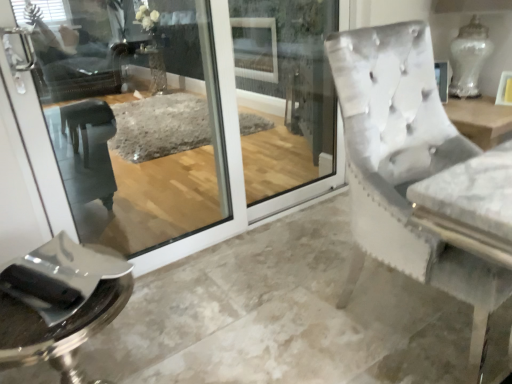
I want to click on clear glass screen door at center, so click(x=240, y=167).

What is the approximate width of clear glass screen door at center?

It is 2.42 inches.

The image size is (512, 384). Describe the element at coordinates (240, 167) in the screenshot. I see `clear glass screen door at center` at that location.

The width and height of the screenshot is (512, 384). I want to click on polished chrome tray at lower left, so click(58, 303).

The width and height of the screenshot is (512, 384). What do you see at coordinates (58, 303) in the screenshot? I see `polished chrome tray at lower left` at bounding box center [58, 303].

What is the approximate height of polished chrome tray at lower left?

polished chrome tray at lower left is 22.85 inches in height.

The width and height of the screenshot is (512, 384). I want to click on clear glass screen door at center, so click(x=240, y=167).

Which is more to the right, polished chrome tray at lower left or clear glass screen door at center?

Positioned to the right is clear glass screen door at center.

Relative to clear glass screen door at center, is polished chrome tray at lower left in front or behind?

In the image, polished chrome tray at lower left appears in front of clear glass screen door at center.

Considering the points (42, 357) and (242, 193), which point is behind, point (42, 357) or point (242, 193)?

The point (242, 193) is behind.

From the image's perspective, is polished chrome tray at lower left on clear glass screen door at center?

No.

From a real-world perspective, which is physically below, polished chrome tray at lower left or clear glass screen door at center?

polished chrome tray at lower left is physically lower.

Considering the relative sizes of polished chrome tray at lower left and clear glass screen door at center in the image provided, is polished chrome tray at lower left thinner than clear glass screen door at center?

No, polished chrome tray at lower left is not thinner than clear glass screen door at center.

Considering the relative sizes of polished chrome tray at lower left and clear glass screen door at center in the image provided, is polished chrome tray at lower left shorter than clear glass screen door at center?

Correct, polished chrome tray at lower left is not as tall as clear glass screen door at center.

From the picture: Who is smaller, polished chrome tray at lower left or clear glass screen door at center?

With smaller size is polished chrome tray at lower left.

Is clear glass screen door at center surrounded by polished chrome tray at lower left?

No, clear glass screen door at center is not a part of polished chrome tray at lower left.

Is polished chrome tray at lower left not close to clear glass screen door at center?

polished chrome tray at lower left is far away from clear glass screen door at center.

Is polished chrome tray at lower left looking in the opposite direction of clear glass screen door at center?

polished chrome tray at lower left does not have its back to clear glass screen door at center.

Can you tell me how much polished chrome tray at lower left and clear glass screen door at center differ in facing direction?

0.143 degrees separate the facing orientations of polished chrome tray at lower left and clear glass screen door at center.

This screenshot has height=384, width=512. In order to click on furniture beneath the clear glass screen door at center (from a real-world perspective) in this screenshot , I will do `click(58, 303)`.

Which is more to the right, clear glass screen door at center or polished chrome tray at lower left?

clear glass screen door at center is more to the right.

In the image, is clear glass screen door at center positioned in front of or behind polished chrome tray at lower left?

clear glass screen door at center is positioned farther from the viewer than polished chrome tray at lower left.

Which point is more distant from viewer, (223, 91) or (62, 283)?

The point (223, 91) is behind.

In the scene shown: From the image's perspective, relative to polished chrome tray at lower left, is clear glass screen door at center above or below?

From the image's perspective, clear glass screen door at center appears above polished chrome tray at lower left.

From a real-world perspective, which is physically above, clear glass screen door at center or polished chrome tray at lower left?

clear glass screen door at center, from a real-world perspective.

Is clear glass screen door at center wider than polished chrome tray at lower left?

In fact, clear glass screen door at center might be narrower than polished chrome tray at lower left.

Between clear glass screen door at center and polished chrome tray at lower left, which one has less height?

With less height is polished chrome tray at lower left.

Considering the sizes of objects clear glass screen door at center and polished chrome tray at lower left in the image provided, who is bigger, clear glass screen door at center or polished chrome tray at lower left?

clear glass screen door at center is bigger.

Is polished chrome tray at lower left surrounded by clear glass screen door at center?

No.

Is clear glass screen door at center directly adjacent to polished chrome tray at lower left?

No, clear glass screen door at center is not next to polished chrome tray at lower left.

Is polished chrome tray at lower left at the back of clear glass screen door at center?

No, clear glass screen door at center is not facing away from polished chrome tray at lower left.

From the picture: Can you tell me how much clear glass screen door at center and polished chrome tray at lower left differ in facing direction?

The facing directions of clear glass screen door at center and polished chrome tray at lower left are 0.143 degrees apart.

I want to click on furniture below the clear glass screen door at center (from the image's perspective), so click(x=58, y=303).

In order to click on screen door on the right of polished chrome tray at lower left in this screenshot , I will do `click(240, 167)`.

In the image, there is a polished chrome tray at lower left. What are the coordinates of `screen door above it (from the image's perspective)` in the screenshot? It's located at (240, 167).